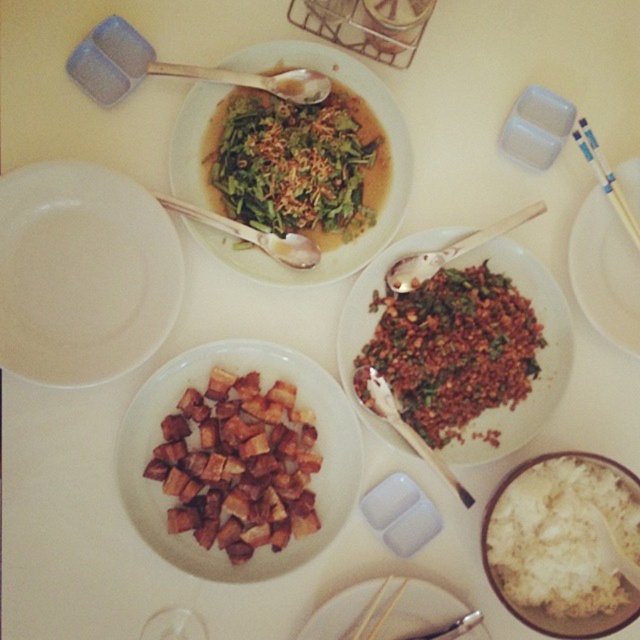
Can you confirm if white fluffy rice at bottom right is positioned below silver spoon at center?

Correct, white fluffy rice at bottom right is located below silver spoon at center.

What do you see at coordinates (563, 540) in the screenshot?
I see `white fluffy rice at bottom right` at bounding box center [563, 540].

This screenshot has height=640, width=640. I want to click on white fluffy rice at bottom right, so click(563, 540).

Who is higher up, white matte plate at upper right or brushed metal spoon at upper center?

Positioned higher is white matte plate at upper right.

Who is positioned more to the left, white matte plate at upper right or brushed metal spoon at upper center?

brushed metal spoon at upper center

Is point (611, 248) closer to camera compared to point (458, 627)?

No, it is behind (458, 627).

Locate an element on the screen. This screenshot has width=640, height=640. white matte plate at upper right is located at coordinates (605, 272).

Who is positioned more to the left, white matte plate at upper left or silver metallic spoon at center?

Positioned to the left is white matte plate at upper left.

Is white matte plate at upper left above silver metallic spoon at center?

Incorrect, white matte plate at upper left is not positioned above silver metallic spoon at center.

Is point (8, 205) positioned before point (196, 209)?

Yes, point (8, 205) is closer to viewer.

Locate an element on the screen. The height and width of the screenshot is (640, 640). white matte plate at upper left is located at coordinates (83, 273).